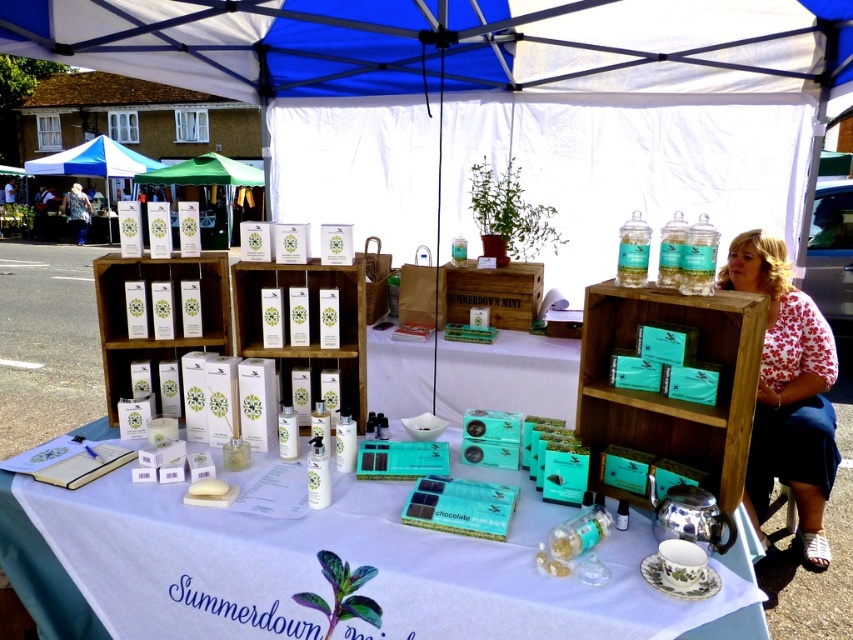
Does point (811, 308) lie behind point (62, 632)?

Yes, point (811, 308) is behind point (62, 632).

The height and width of the screenshot is (640, 853). Describe the element at coordinates (787, 392) in the screenshot. I see `white floral shirt at upper right` at that location.

Where is `white floral shirt at upper right`? This screenshot has width=853, height=640. white floral shirt at upper right is located at coordinates (x=787, y=392).

Which is more to the right, blue fabric canopy at upper center or white floral shirt at upper right?

Positioned to the right is white floral shirt at upper right.

Is point (271, 86) in front of point (801, 529)?

No, (271, 86) is behind (801, 529).

Locate an element on the screen. This screenshot has width=853, height=640. blue fabric canopy at upper center is located at coordinates (444, 40).

Does blue fabric canopy at upper center appear over white glossy table at center?

Indeed, blue fabric canopy at upper center is positioned over white glossy table at center.

Is blue fabric canopy at upper center taller than white glossy table at center?

Indeed, blue fabric canopy at upper center has a greater height compared to white glossy table at center.

Looking at this image, measure the distance between blue fabric canopy at upper center and camera.

blue fabric canopy at upper center is 9.28 feet away from camera.

I want to click on blue fabric canopy at upper center, so click(x=444, y=40).